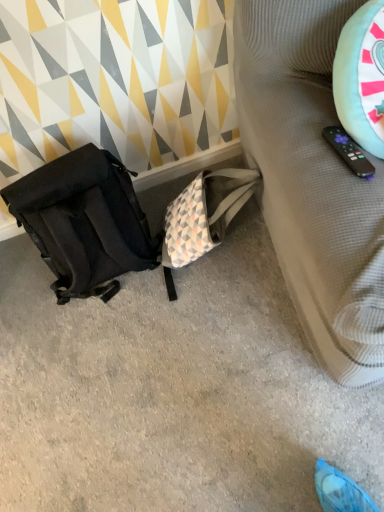
Question: Considering the relative sizes of textured beige sofa at right and black fabric backpack at left in the image provided, is textured beige sofa at right wider than black fabric backpack at left?

Choices:
 (A) no
 (B) yes

Answer: (A)

Question: From the image's perspective, is textured beige sofa at right on black fabric backpack at left?

Choices:
 (A) no
 (B) yes

Answer: (B)

Question: From a real-world perspective, is textured beige sofa at right on top of black fabric backpack at left?

Choices:
 (A) no
 (B) yes

Answer: (B)

Question: Is textured beige sofa at right not close to black fabric backpack at left?

Choices:
 (A) no
 (B) yes

Answer: (A)

Question: Would you say textured beige sofa at right is outside black fabric backpack at left?

Choices:
 (A) no
 (B) yes

Answer: (B)

Question: Is textured beige sofa at right smaller than black fabric backpack at left?

Choices:
 (A) no
 (B) yes

Answer: (A)

Question: Can you confirm if black fabric backpack at left is taller than textured beige sofa at right?

Choices:
 (A) yes
 (B) no

Answer: (B)

Question: From the image's perspective, is black fabric backpack at left located beneath textured beige sofa at right?

Choices:
 (A) yes
 (B) no

Answer: (A)

Question: Considering the relative sizes of black fabric backpack at left and textured beige sofa at right in the image provided, is black fabric backpack at left thinner than textured beige sofa at right?

Choices:
 (A) yes
 (B) no

Answer: (B)

Question: Considering the relative positions of black fabric backpack at left and textured beige sofa at right in the image provided, is black fabric backpack at left to the right of textured beige sofa at right from the viewer's perspective?

Choices:
 (A) no
 (B) yes

Answer: (A)

Question: Is black fabric backpack at left behind textured beige sofa at right?

Choices:
 (A) no
 (B) yes

Answer: (B)

Question: Is black fabric backpack at left shorter than textured beige sofa at right?

Choices:
 (A) no
 (B) yes

Answer: (B)

Question: Does black fabric backpack at left contain matte black backpack at left?

Choices:
 (A) no
 (B) yes

Answer: (A)